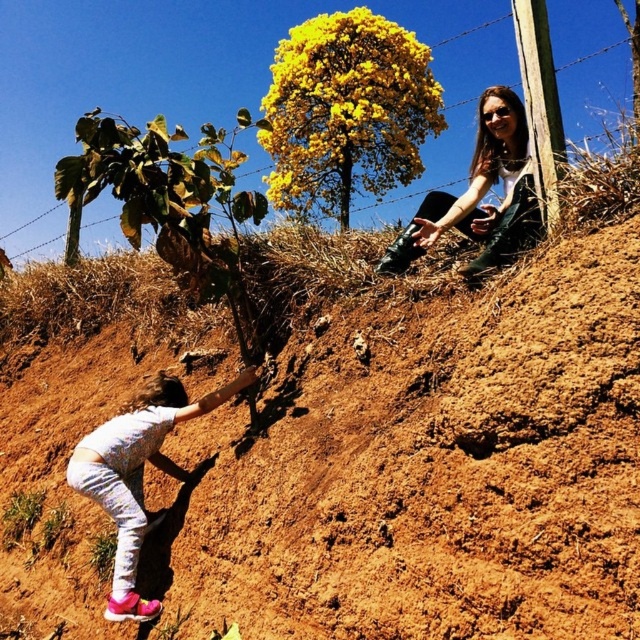
You are standing in the garden and see the brown dirt at lower right and the white cotton pants at lower left. Which object is higher in elevation?

The brown dirt at lower right is taller than the white cotton pants at lower left, so the brown dirt at lower right has a higher elevation.

You are standing at the center of the image and want to place a small flag exactly where the white cotton pants at lower left are located. According to the coordinates provided, what are the coordinates you should aim for?

The coordinates for the white cotton pants at lower left are point (138, 474).